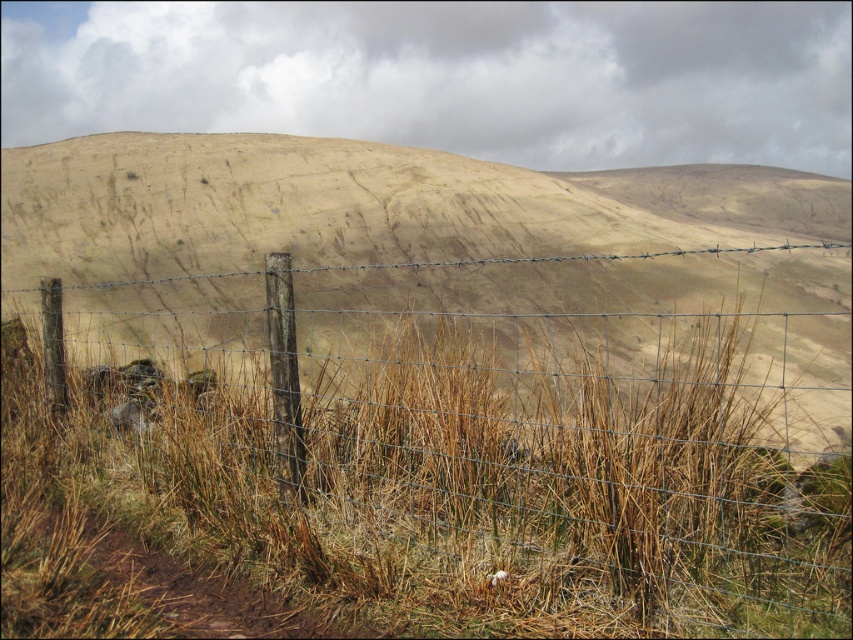
You are standing in the middle of the rural landscape and see the wire mesh fence at center and the dried grass at center. Which object is positioned to the right of the other?

The wire mesh fence at center is to the right of dried grass at center.

You are a farmer checking the boundaries of your property. You see the wire mesh fence at center and the dried grass at center. Which one is narrower in width?

The wire mesh fence at center has a lesser width compared to dried grass at center, so the wire mesh fence at center is narrower.

You are a hiker who wants to cross the wire mesh fence at center. You notice dried grass at center nearby. Which object is lower in elevation?

The wire mesh fence at center is below dried grass at center, so the wire mesh fence at center is lower in elevation.